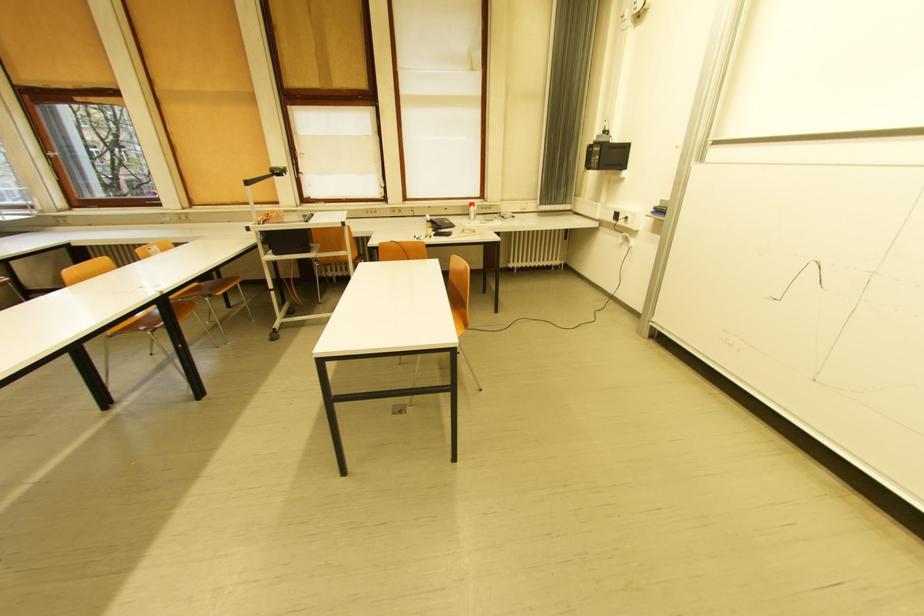
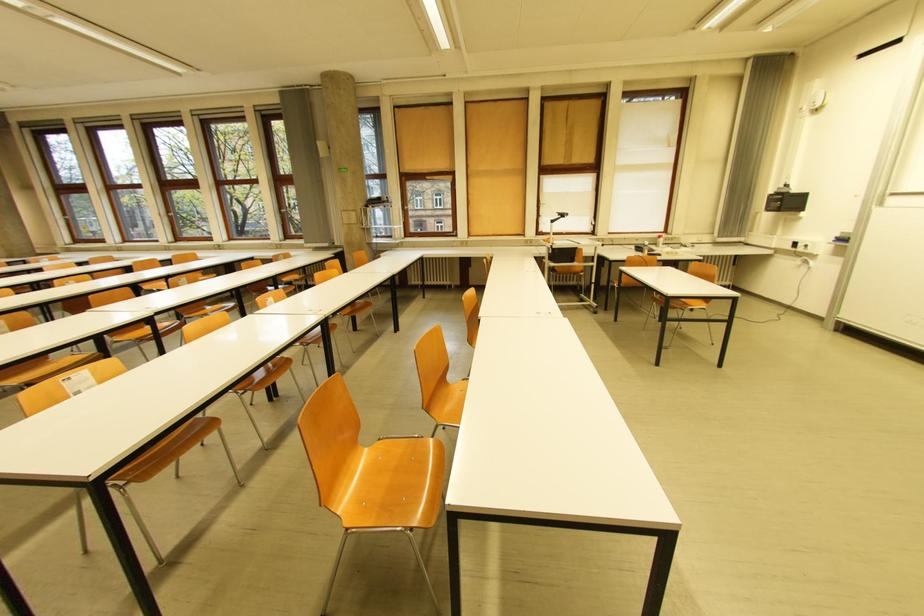
Locate, in the second image, the point that corresponds to point 203,203 in the first image.

(479, 235)